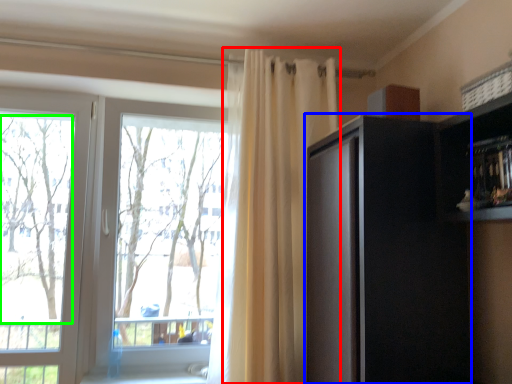
Question: Which object is positioned closest to curtain (highlighted by a red box)? Select from cabinetry (highlighted by a blue box) and tree (highlighted by a green box).

Choices:
 (A) cabinetry
 (B) tree

Answer: (A)